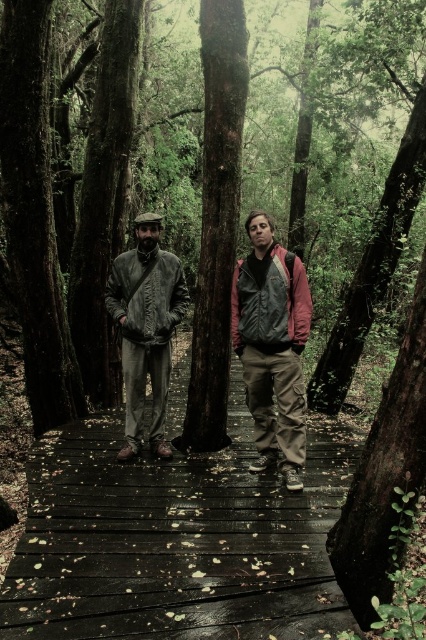
Does distressed leather jacket at center appear over matte leather jacket at center?

Actually, distressed leather jacket at center is below matte leather jacket at center.

Between distressed leather jacket at center and matte leather jacket at center, which one has more height?

With more height is distressed leather jacket at center.

Who is more distant from viewer, (146, 227) or (152, 230)?

Positioned behind is point (152, 230).

You are a GUI agent. You are given a task and a screenshot of the screen. Output one action in this format:
    pyautogui.click(x=<x>, y=<y>)
    Task: Click on the distressed leather jacket at center
    The width and height of the screenshot is (426, 640).
    Given the screenshot: What is the action you would take?
    pyautogui.click(x=271, y=346)

Is distressed leather jacket at center thinner than matte black jacket at center?

No, distressed leather jacket at center is not thinner than matte black jacket at center.

Who is positioned more to the right, distressed leather jacket at center or matte black jacket at center?

matte black jacket at center

Does point (293, 305) come closer to viewer compared to point (267, 236)?

That is True.

Find the location of `distressed leather jacket at center`. distressed leather jacket at center is located at coordinates (271, 346).

Can you confirm if dark wood path at center is positioned to the right of matte leather jacket at center?

Indeed, dark wood path at center is positioned on the right side of matte leather jacket at center.

Is point (28, 525) positioned behind point (170, 337)?

No, (28, 525) is in front of (170, 337).

Who is more distant from viewer, (218, 614) or (138, 328)?

Point (138, 328)

Image resolution: width=426 pixels, height=640 pixels. In order to click on dark wood path at center in this screenshot , I will do `click(176, 540)`.